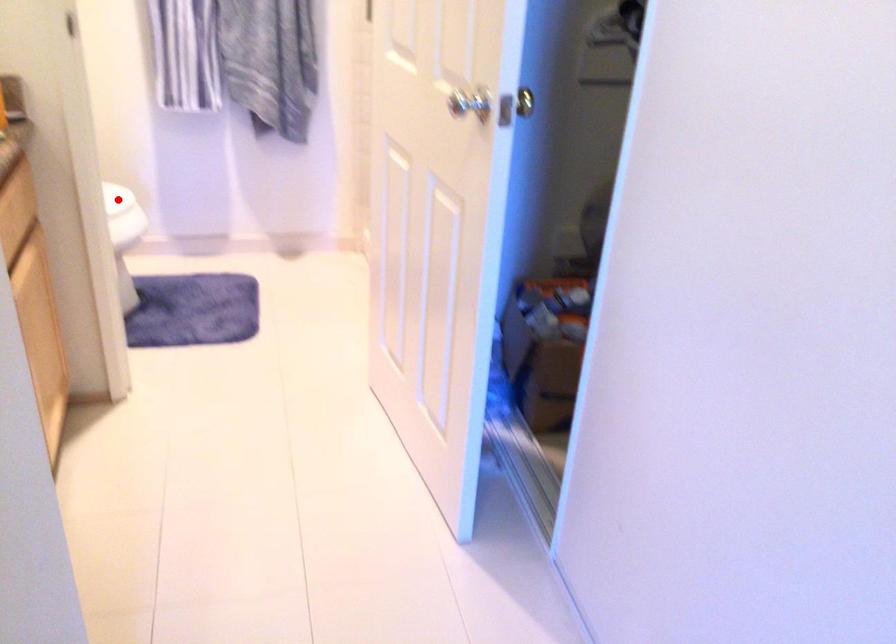
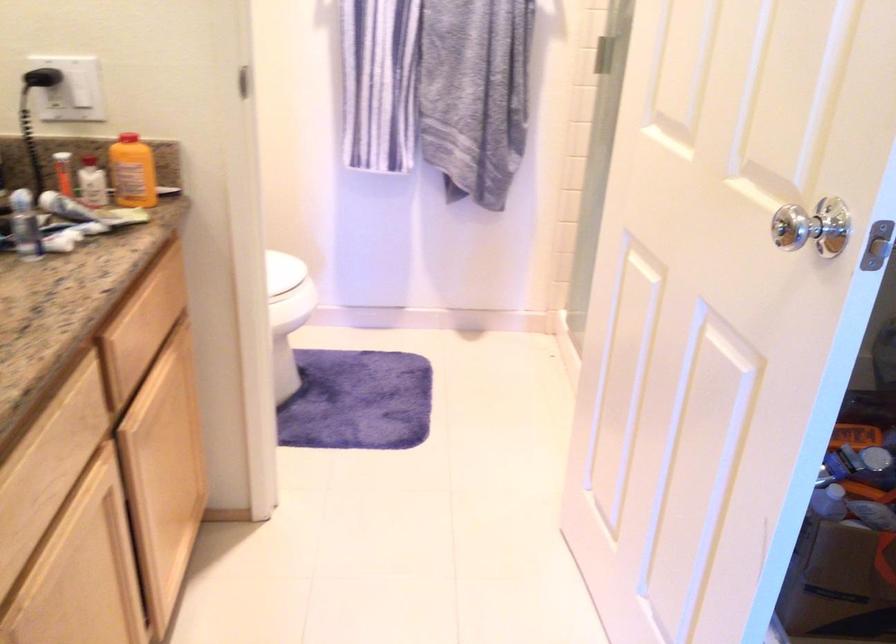
Locate, in the second image, the point that corresponds to the highlighted location in the first image.

(282, 270)